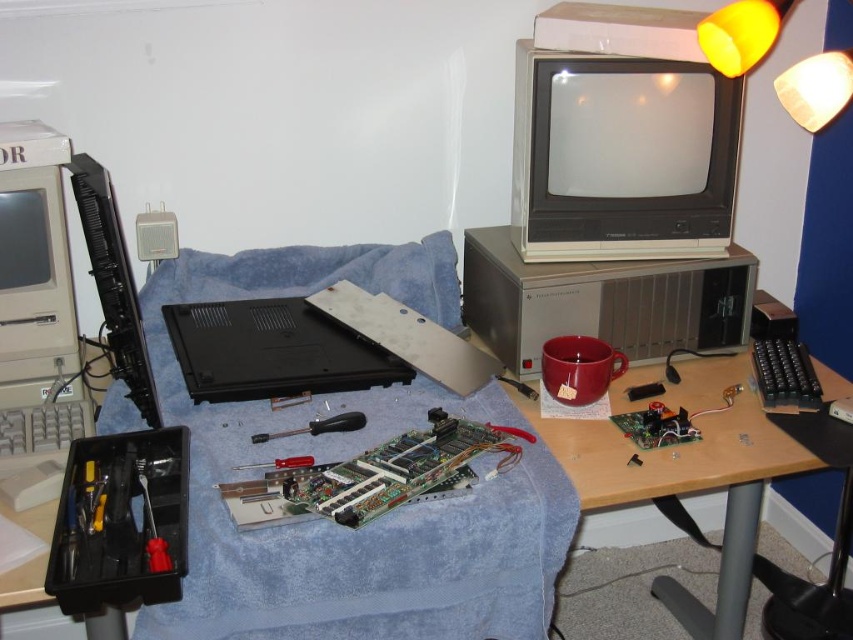
You are setting up a workspace for computer repair. You have a metallic gray desktop computer at center and a screwdriver metallic at lower left. Which object takes up more space in the workspace?

The metallic gray desktop computer at center is bigger than the screwdriver metallic at lower left, so it takes up more space in the workspace.

You need to place both the gray plastic keyboard at lower left and the screwdriver at center into a storage box. The box has a width of 30 cm. Based on their sizes, can both items fit side by side horizontally in the box?

The gray plastic keyboard at lower left might be wider than the screwdriver at center. If the keyboard is wider than 30 cm, they cannot fit side by side. If the keyboard is narrower than 30 cm, there might be enough space for both.

You are a technician working on a computer repair. You need to reach both the gray plastic keyboard at lower left and the screwdriver at center. Which object is closer to you?

The gray plastic keyboard at lower left is closer to the viewer than the screwdriver at center.